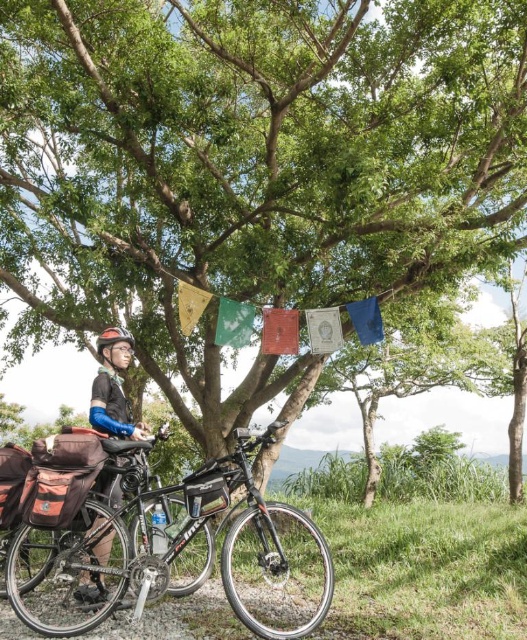
Between point (172, 492) and point (102, 541), which one is positioned behind?

Positioned behind is point (102, 541).

Can you confirm if shiny metallic bicycle at center is positioned to the right of matte black helmet at upper left?

Correct, you'll find shiny metallic bicycle at center to the right of matte black helmet at upper left.

Where is `shiny metallic bicycle at center`? The height and width of the screenshot is (640, 527). shiny metallic bicycle at center is located at coordinates (159, 540).

Locate an element on the screen. shiny metallic bicycle at center is located at coordinates (159, 540).